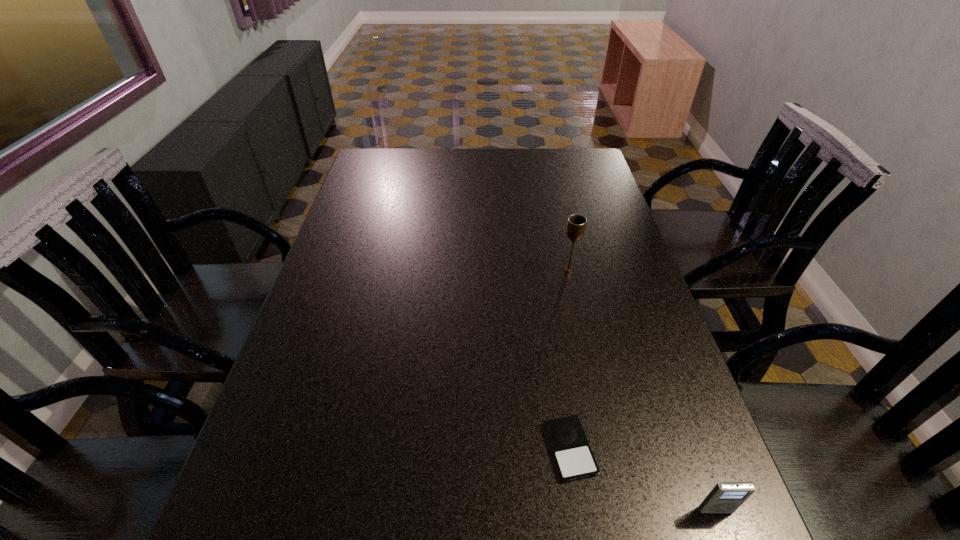
Locate an element on the screen. The width and height of the screenshot is (960, 540). vacant point at the left edge is located at coordinates (252, 464).

Locate an element on the screen. The width and height of the screenshot is (960, 540). free space at the right edge of the desktop is located at coordinates (596, 315).

In the image, there is a desktop. Find the location of `free space at the far right corner`. free space at the far right corner is located at coordinates (559, 170).

The image size is (960, 540). I want to click on empty location between the farther iPod and the nearer iPod, so click(x=642, y=479).

Find the location of a particular element. The image size is (960, 540). unoccupied area between the leftmost object and the nearer iPod is located at coordinates [x=642, y=479].

Where is `free space between the shortest object and the second object from right to left`? This screenshot has width=960, height=540. free space between the shortest object and the second object from right to left is located at coordinates (569, 360).

At what (x,y) coordinates should I click in order to perform the action: click on free space between the second object from right to left and the right iPod. Please return your answer as a coordinate pair (x, y). The image size is (960, 540). Looking at the image, I should click on (642, 390).

Identify the location of vacant area between the leftmost object and the chalice. click(569, 360).

You are a GUI agent. You are given a task and a screenshot of the screen. Output one action in this format:
    pyautogui.click(x=<x>, y=<y>)
    Task: Click on the blank region between the shorter iPod and the second tallest object
    Image resolution: width=960 pixels, height=540 pixels.
    Given the screenshot: What is the action you would take?
    pyautogui.click(x=642, y=479)

Locate an element on the screen. The image size is (960, 540). empty location between the nearest object and the second object from right to left is located at coordinates (642, 390).